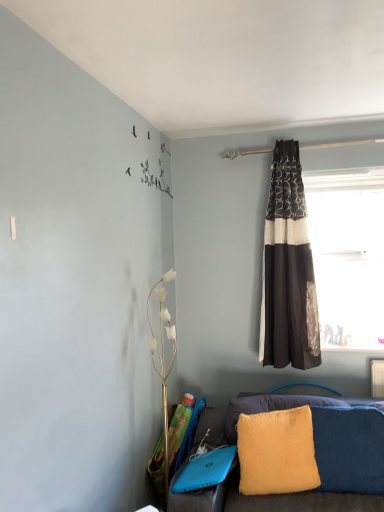
Question: Can you confirm if fuzzy yellow pillow at lower right is taller than transparent glass window at upper right?

Choices:
 (A) yes
 (B) no

Answer: (B)

Question: Is fuzzy yellow pillow at lower right far from transparent glass window at upper right?

Choices:
 (A) no
 (B) yes

Answer: (A)

Question: Does fuzzy yellow pillow at lower right have a smaller size compared to transparent glass window at upper right?

Choices:
 (A) no
 (B) yes

Answer: (B)

Question: Does fuzzy yellow pillow at lower right appear on the left side of transparent glass window at upper right?

Choices:
 (A) no
 (B) yes

Answer: (B)

Question: Is transparent glass window at upper right completely or partially inside fuzzy yellow pillow at lower right?

Choices:
 (A) yes
 (B) no

Answer: (B)

Question: Which is correct: fuzzy yellow pillow at lower right is inside black textured curtain at right, or outside of it?

Choices:
 (A) outside
 (B) inside

Answer: (A)

Question: Looking at their shapes, would you say fuzzy yellow pillow at lower right is wider or thinner than black textured curtain at right?

Choices:
 (A) thin
 (B) wide

Answer: (A)

Question: Based on their sizes in the image, would you say fuzzy yellow pillow at lower right is bigger or smaller than black textured curtain at right?

Choices:
 (A) small
 (B) big

Answer: (A)

Question: Is point (316, 463) positioned closer to the camera than point (279, 259)?

Choices:
 (A) farther
 (B) closer

Answer: (B)

Question: Based on their sizes in the image, would you say fuzzy yellow pillow at lower right is bigger or smaller than transparent glass window at upper right?

Choices:
 (A) small
 (B) big

Answer: (A)

Question: Looking at their shapes, would you say fuzzy yellow pillow at lower right is wider or thinner than transparent glass window at upper right?

Choices:
 (A) thin
 (B) wide

Answer: (B)

Question: Does point (291, 461) appear closer or farther from the camera than point (319, 285)?

Choices:
 (A) farther
 (B) closer

Answer: (B)

Question: Which is correct: fuzzy yellow pillow at lower right is inside transparent glass window at upper right, or outside of it?

Choices:
 (A) inside
 (B) outside

Answer: (B)

Question: From their relative heights in the image, would you say transparent glass window at upper right is taller or shorter than fuzzy yellow pillow at lower right?

Choices:
 (A) short
 (B) tall

Answer: (B)

Question: From the image's perspective, is transparent glass window at upper right located above or below fuzzy yellow pillow at lower right?

Choices:
 (A) below
 (B) above

Answer: (B)